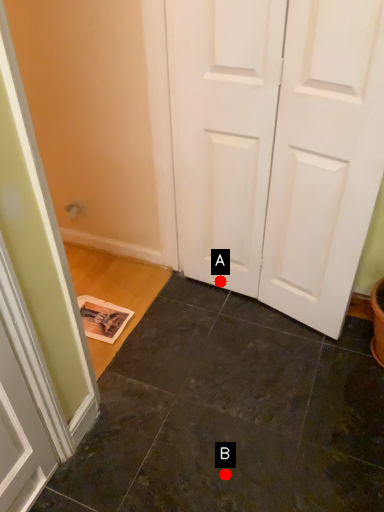
Question: Two points are circled on the image, labeled by A and B beside each circle. Which point is closer to the camera?

Choices:
 (A) A is closer
 (B) B is closer

Answer: (B)